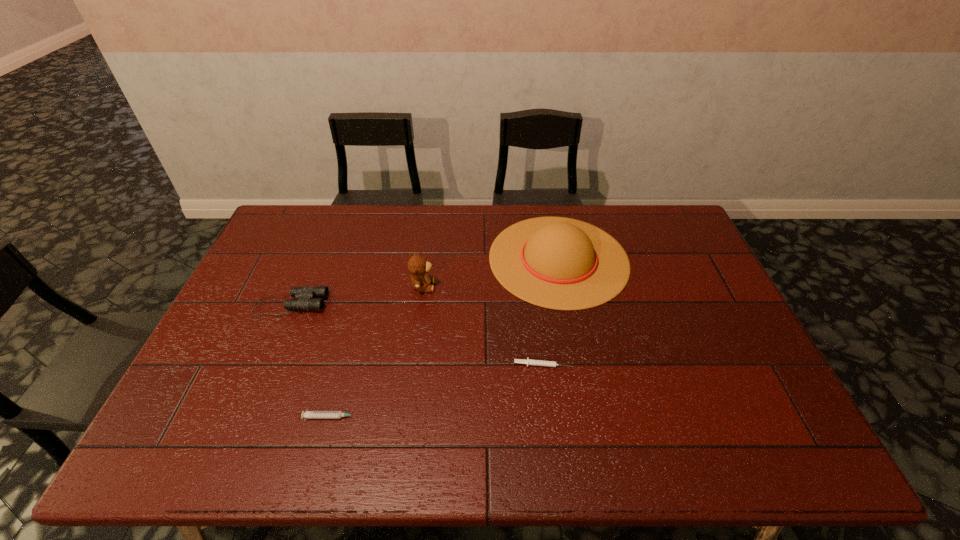
Find the location of `sombrero`. sombrero is located at coordinates (559, 263).

The height and width of the screenshot is (540, 960). Find the location of `teddy bear`. teddy bear is located at coordinates point(418,266).

The height and width of the screenshot is (540, 960). In order to click on binoculars in this screenshot , I will do `click(304, 299)`.

Where is `the leftmost object`? This screenshot has width=960, height=540. the leftmost object is located at coordinates (304, 299).

You are a GUI agent. You are given a task and a screenshot of the screen. Output one action in this format:
    pyautogui.click(x=<x>, y=<y>)
    Task: Click on the nearest object
    
    Given the screenshot: What is the action you would take?
    pyautogui.click(x=306, y=414)

Identify the location of the nearer syringe. (306, 414).

This screenshot has height=540, width=960. In order to click on the fourth farthest object in this screenshot , I will do [529, 362].

Identify the location of the farther syringe. This screenshot has height=540, width=960. (529, 362).

The image size is (960, 540). What are the coordinates of `vacant region located 0.180m on the left of the sombrero` in the screenshot? It's located at (435, 259).

Locate an element on the screen. free space located 0.130m on the face of the third object from right to left is located at coordinates (477, 286).